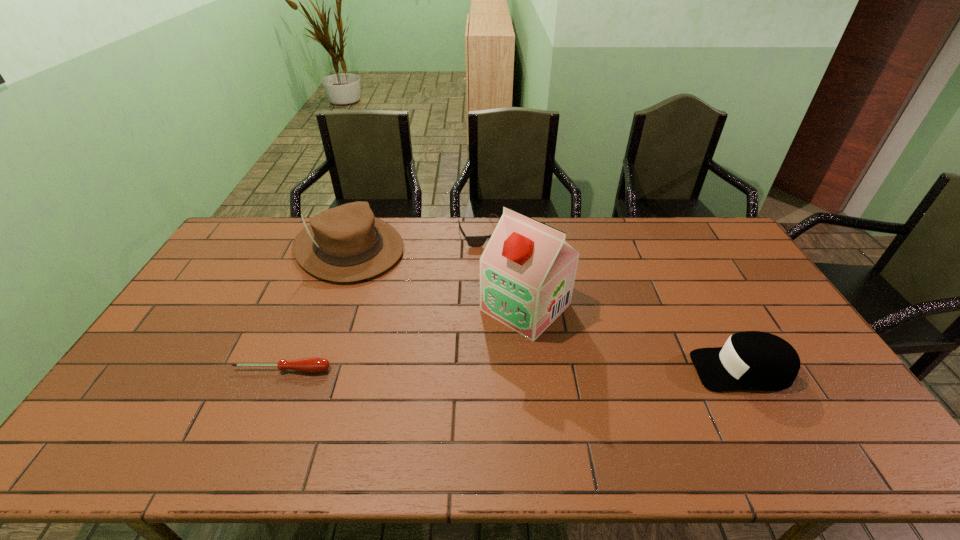
Identify the location of sunglasses positioned at the far edge. This screenshot has width=960, height=540. (473, 241).

Find the location of a particular element. object that is positioned at the near edge is located at coordinates (750, 360).

Image resolution: width=960 pixels, height=540 pixels. What are the coordinates of `object that is positioned at the right edge` in the screenshot? It's located at (750, 360).

Locate an element on the screen. object at the near right corner is located at coordinates (750, 360).

I want to click on vacant space at the far edge of the desktop, so click(x=456, y=219).

At what (x,y) coordinates should I click in order to perform the action: click on vacant space at the near edge of the desktop. Please return your answer as a coordinate pair (x, y). This screenshot has height=540, width=960. Looking at the image, I should click on (624, 401).

Identify the location of vacant region at the left edge of the desktop. This screenshot has height=540, width=960. (213, 284).

At what (x,y) coordinates should I click in order to perform the action: click on free spot at the far left corner of the desktop. Please return your answer as a coordinate pair (x, y). The height and width of the screenshot is (540, 960). Looking at the image, I should click on point(234,241).

The image size is (960, 540). In order to click on free location at the far right corner of the desktop in this screenshot , I will do `click(711, 241)`.

In the image, there is a desktop. Where is `vacant space at the near right corner`? vacant space at the near right corner is located at coordinates (832, 416).